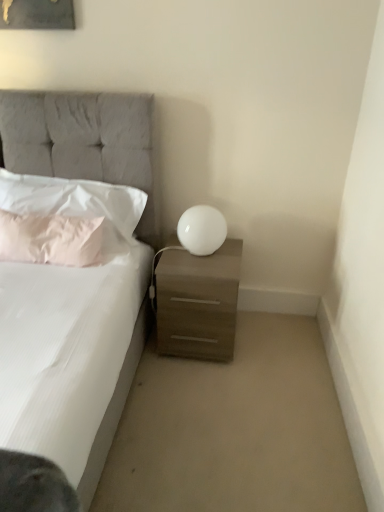
Where is `free space in front of white glossy sphere at right`? Image resolution: width=384 pixels, height=512 pixels. free space in front of white glossy sphere at right is located at coordinates (200, 269).